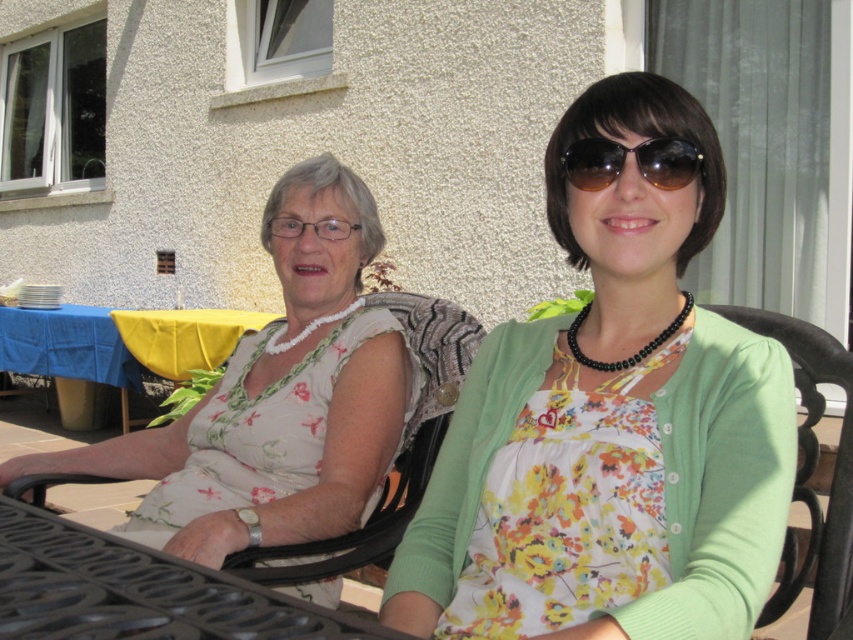
You are standing in the garden and want to place a small potted plant at point (643,556). If your arm reaches 3 feet, can you comfortably place it there without moving your feet?

The distance of point (643,556) from viewer is 3.76 feet, so you cannot comfortably reach it with your arm which only extends 3 feet. You would need to move closer or take a step forward.